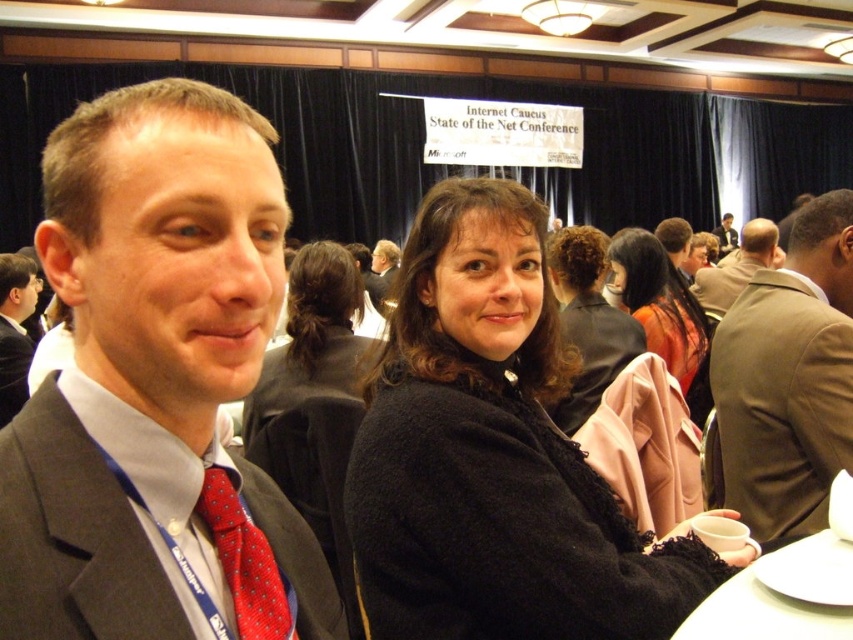
Question: Among these points, which one is farthest from the camera?

Choices:
 (A) (720, 224)
 (B) (590, 340)
 (C) (758, 625)

Answer: (A)

Question: Is orange fabric coat at center positioned before white ceramic plate at lower right?

Choices:
 (A) yes
 (B) no

Answer: (B)

Question: Estimate the real-world distances between objects in this image. Which object is closer to the brown wool suit at right?

Choices:
 (A) white ceramic plate at lower right
 (B) matte black jacket at center
 (C) black fuzzy coat at center
 (D) brown wool suit at upper right

Answer: (C)

Question: Does brown wool suit at right appear over matte black suit at left?

Choices:
 (A) no
 (B) yes

Answer: (A)

Question: Which of the following is the closest to the observer?

Choices:
 (A) (16, 348)
 (B) (577, 401)
 (C) (1, 592)

Answer: (C)

Question: Can you confirm if black wool coat at center is wider than matte black jacket at center?

Choices:
 (A) yes
 (B) no

Answer: (B)